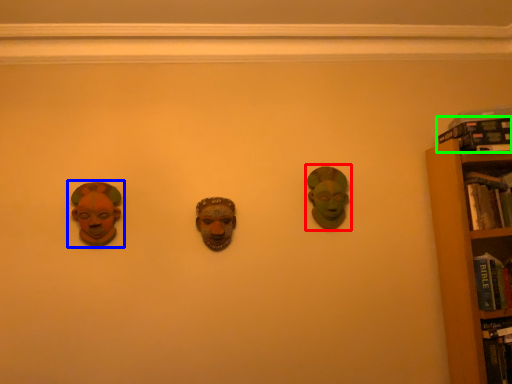
Question: Which object is positioned farthest from head (highlighted by a red box)? Select from head (highlighted by a blue box) and book (highlighted by a green box).

Choices:
 (A) head
 (B) book

Answer: (A)